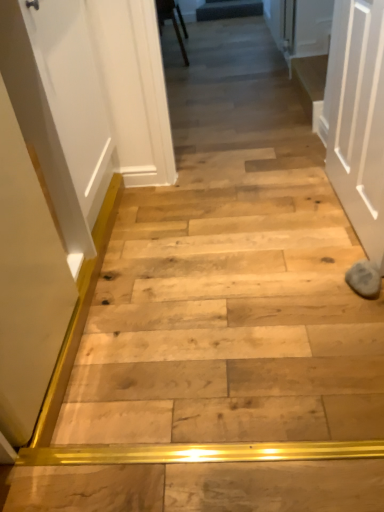
Describe the element at coordinates (312, 81) in the screenshot. I see `wooden step at center, the 1th stairwell from the right` at that location.

Where is `dark gray fabric at upper center, the second stairwell positioned from the right`? The image size is (384, 512). dark gray fabric at upper center, the second stairwell positioned from the right is located at coordinates (228, 9).

Considering the sizes of objects wooden step at center, which is the second stairwell in left-to-right order, and white matte door at right in the image provided, who is taller, wooden step at center, which is the second stairwell in left-to-right order, or white matte door at right?

Standing taller between the two is white matte door at right.

Is the depth of wooden step at center, which is the second stairwell in left-to-right order, greater than that of white matte door at right?

Yes, wooden step at center, which is the second stairwell in left-to-right order, is behind white matte door at right.

Who is bigger, wooden step at center, which is the 2th stairwell in back-to-front order, or white matte door at right?

With larger size is white matte door at right.

Measure the distance between wooden step at center, which is the 1th stairwell in bottom-to-top order, and white matte door at right.

3.60 feet.

Considering the relative positions of wooden step at center, the 1th stairwell from the right, and dark gray fabric at upper center, which appears as the 1th stairwell when viewed from the left, in the image provided, is wooden step at center, the 1th stairwell from the right, to the left or to the right of dark gray fabric at upper center, which appears as the 1th stairwell when viewed from the left,?

Based on their positions, wooden step at center, the 1th stairwell from the right, is located to the right of dark gray fabric at upper center, which appears as the 1th stairwell when viewed from the left.

Which is correct: wooden step at center, marked as the second stairwell in a top-to-bottom arrangement, is inside dark gray fabric at upper center, which appears as the 1th stairwell when viewed from the top, or outside of it?

wooden step at center, marked as the second stairwell in a top-to-bottom arrangement, cannot be found inside dark gray fabric at upper center, which appears as the 1th stairwell when viewed from the top.

From the image's perspective, is wooden step at center, which is the 2th stairwell in back-to-front order, below dark gray fabric at upper center, which appears as the 1th stairwell when viewed from the top?

Correct, wooden step at center, which is the 2th stairwell in back-to-front order, appears lower than dark gray fabric at upper center, which appears as the 1th stairwell when viewed from the top, in the image.

In the image, there is a dark gray fabric at upper center, which appears as the 1th stairwell when viewed from the left. Identify the location of stairwell below it (from a real-world perspective). (312, 81).

Is the position of dark gray fabric at upper center, the second stairwell positioned from the right, more distant than that of wooden chair at upper center?

Yes, dark gray fabric at upper center, the second stairwell positioned from the right, is behind wooden chair at upper center.

In the scene shown: Can you confirm if dark gray fabric at upper center, which appears as the 1th stairwell when viewed from the top, is positioned to the left of wooden chair at upper center?

In fact, dark gray fabric at upper center, which appears as the 1th stairwell when viewed from the top, is to the right of wooden chair at upper center.

Is dark gray fabric at upper center, which appears as the 1th stairwell when viewed from the top, oriented away from wooden chair at upper center?

No, dark gray fabric at upper center, which appears as the 1th stairwell when viewed from the top, is not facing the opposite direction of wooden chair at upper center.

Can you see dark gray fabric at upper center, which appears as the 1th stairwell when viewed from the top, touching wooden chair at upper center?

No, dark gray fabric at upper center, which appears as the 1th stairwell when viewed from the top, is not next to wooden chair at upper center.

How many degrees apart are the facing directions of wooden chair at upper center and dark gray fabric at upper center, the second stairwell positioned from the right?

93.7 degrees.

Based on the photo, considering the sizes of objects wooden chair at upper center and dark gray fabric at upper center, the 2th stairwell positioned from the bottom, in the image provided, who is shorter, wooden chair at upper center or dark gray fabric at upper center, the 2th stairwell positioned from the bottom,?

Standing shorter between the two is dark gray fabric at upper center, the 2th stairwell positioned from the bottom.

From the image's perspective, between wooden chair at upper center and dark gray fabric at upper center, which appears as the 1th stairwell when viewed from the left, which one is located above?

dark gray fabric at upper center, which appears as the 1th stairwell when viewed from the left, appears higher in the image.

Could you tell me if wooden chair at upper center is facing dark gray fabric at upper center, which is the second stairwell in front-to-back order?

No, wooden chair at upper center does not turn towards dark gray fabric at upper center, which is the second stairwell in front-to-back order.

Is wooden step at center, the 1th stairwell from the right, thinner than wooden chair at upper center?

Yes, wooden step at center, the 1th stairwell from the right, is thinner than wooden chair at upper center.

Considering the sizes of objects wooden step at center, the 1th stairwell positioned from the front, and wooden chair at upper center in the image provided, who is taller, wooden step at center, the 1th stairwell positioned from the front, or wooden chair at upper center?

Standing taller between the two is wooden chair at upper center.

Is wooden chair at upper center surrounded by wooden step at center, which is the 1th stairwell in bottom-to-top order?

No, wooden chair at upper center is not surrounded by wooden step at center, which is the 1th stairwell in bottom-to-top order.

Considering the positions of point (314, 123) and point (185, 35), is point (314, 123) closer or farther from the camera than point (185, 35)?

Point (314, 123) appears to be closer to the viewer than point (185, 35).

Is dark gray fabric at upper center, which appears as the 1th stairwell when viewed from the left, located outside wooden step at center, which is the 2th stairwell in back-to-front order?

That's correct, dark gray fabric at upper center, which appears as the 1th stairwell when viewed from the left, is outside of wooden step at center, which is the 2th stairwell in back-to-front order.

Is dark gray fabric at upper center, the second stairwell positioned from the right, at the right side of wooden step at center, which is the 1th stairwell in bottom-to-top order?

In fact, dark gray fabric at upper center, the second stairwell positioned from the right, is to the left of wooden step at center, which is the 1th stairwell in bottom-to-top order.

Does dark gray fabric at upper center, the 2th stairwell positioned from the bottom, turn towards wooden step at center, the 1th stairwell from the right?

Yes, dark gray fabric at upper center, the 2th stairwell positioned from the bottom, faces towards wooden step at center, the 1th stairwell from the right.

Can you tell me how much dark gray fabric at upper center, which is the second stairwell in front-to-back order, and wooden step at center, which is the second stairwell in left-to-right order, differ in facing direction?

There is a 89.3-degree angle between the facing directions of dark gray fabric at upper center, which is the second stairwell in front-to-back order, and wooden step at center, which is the second stairwell in left-to-right order.

Which point is more forward, (367, 4) or (158, 4)?

Positioned in front is point (367, 4).

Based on the photo, is white matte door at right not inside wooden chair at upper center?

Indeed, white matte door at right is completely outside wooden chair at upper center.

Between white matte door at right and wooden chair at upper center, which one has smaller width?

white matte door at right.

Who is taller, white matte door at right or wooden chair at upper center?

Standing taller between the two is white matte door at right.

Find the location of a particular element. This screenshot has width=384, height=512. door located in front of the wooden step at center, the 1th stairwell positioned from the front is located at coordinates (357, 118).

What are the coordinates of `stairwell that is behind the wooden step at center, the 1th stairwell positioned from the front` in the screenshot? It's located at (228, 9).

Looking at the image, which one is located closer to wooden step at center, which is the 2th stairwell in back-to-front order, dark gray fabric at upper center, which appears as the 1th stairwell when viewed from the top, or wooden chair at upper center?

wooden chair at upper center is positioned closer to the anchor wooden step at center, which is the 2th stairwell in back-to-front order.

Consider the image. Looking at the image, which one is located closer to wooden step at center, marked as the second stairwell in a top-to-bottom arrangement, wooden chair at upper center or white matte door at right?

The object closer to wooden step at center, marked as the second stairwell in a top-to-bottom arrangement, is white matte door at right.

From the image, which object appears to be farther from white matte door at right, wooden chair at upper center or dark gray fabric at upper center, which appears as the 1th stairwell when viewed from the top?

Based on the image, dark gray fabric at upper center, which appears as the 1th stairwell when viewed from the top, appears to be further to white matte door at right.

Looking at this image, based on their spatial positions, is dark gray fabric at upper center, which appears as the 1th stairwell when viewed from the top, or wooden step at center, the 1th stairwell from the right, closer to white matte door at right?

wooden step at center, the 1th stairwell from the right, lies closer to white matte door at right than the other object.

From the image, which object appears to be farther from wooden chair at upper center, wooden step at center, which is the second stairwell in left-to-right order, or white matte door at right?

white matte door at right lies further to wooden chair at upper center than the other object.

Based on the photo, when comparing their distances from wooden step at center, which is the 2th stairwell in back-to-front order, does dark gray fabric at upper center, arranged as the 1th stairwell when viewed from the back, or white matte door at right seem further?

dark gray fabric at upper center, arranged as the 1th stairwell when viewed from the back.

Estimate the real-world distances between objects in this image. Which object is closer to white matte door at right, dark gray fabric at upper center, which appears as the 1th stairwell when viewed from the top, or wooden chair at upper center?

Among the two, wooden chair at upper center is located nearer to white matte door at right.

Looking at the image, which one is located closer to white matte door at right, wooden chair at upper center or wooden step at center, the 1th stairwell from the right?

Among the two, wooden step at center, the 1th stairwell from the right, is located nearer to white matte door at right.

You are a GUI agent. You are given a task and a screenshot of the screen. Output one action in this format:
    pyautogui.click(x=<x>, y=<y>)
    Task: Click on the furniture between wooden step at center, marked as the second stairwell in a top-to-bottom arrangement, and dark gray fabric at upper center, the second stairwell positioned from the right, along the z-axis
    Image resolution: width=384 pixels, height=512 pixels.
    Given the screenshot: What is the action you would take?
    pyautogui.click(x=172, y=22)

You are a GUI agent. You are given a task and a screenshot of the screen. Output one action in this format:
    pyautogui.click(x=<x>, y=<y>)
    Task: Click on the furniture between white matte door at right and dark gray fabric at upper center, the 2th stairwell positioned from the bottom, from front to back
    The width and height of the screenshot is (384, 512).
    Given the screenshot: What is the action you would take?
    pyautogui.click(x=172, y=22)

Where is `stairwell between white matte door at right and dark gray fabric at upper center, which appears as the 1th stairwell when viewed from the left, along the z-axis`? stairwell between white matte door at right and dark gray fabric at upper center, which appears as the 1th stairwell when viewed from the left, along the z-axis is located at coordinates (312, 81).

Find the location of a particular element. stairwell between white matte door at right and wooden chair at upper center in the front-back direction is located at coordinates (312, 81).